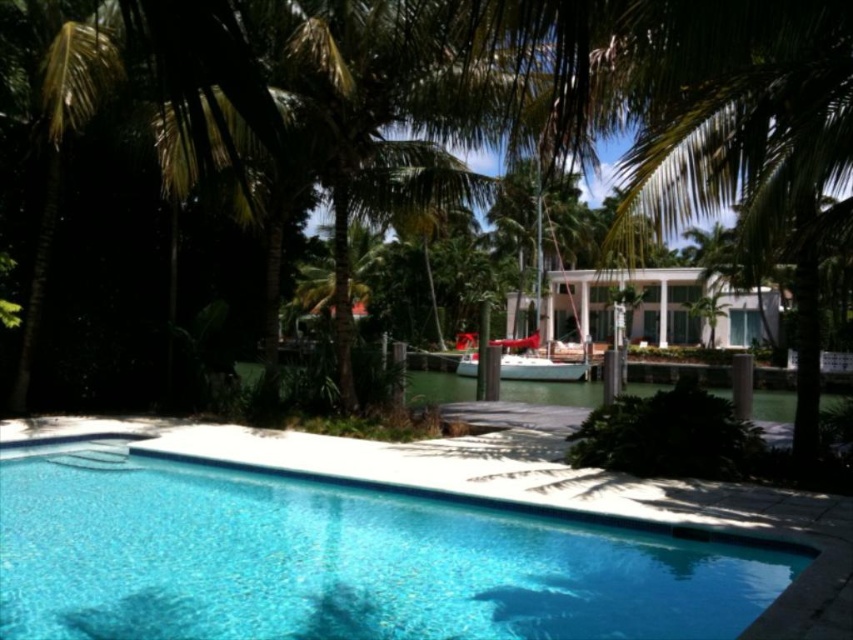
You are standing at the edge of the pool and want to walk to the point labeled point (686, 195). However, there is an obstacle at point (535, 346). Will you encounter this obstacle on your way?

Yes, you will encounter the obstacle at point (535, 346) because point (686, 195) is in front of it, meaning the obstacle is along the path towards your destination.

You are planning to install a solar panel on the tallest object in the scene. Which object should you choose between the green leafy palm tree at center and the red plastic boat at center?

The red plastic boat at center is taller than the green leafy palm tree at center, so you should install the solar panel on the red plastic boat at center.